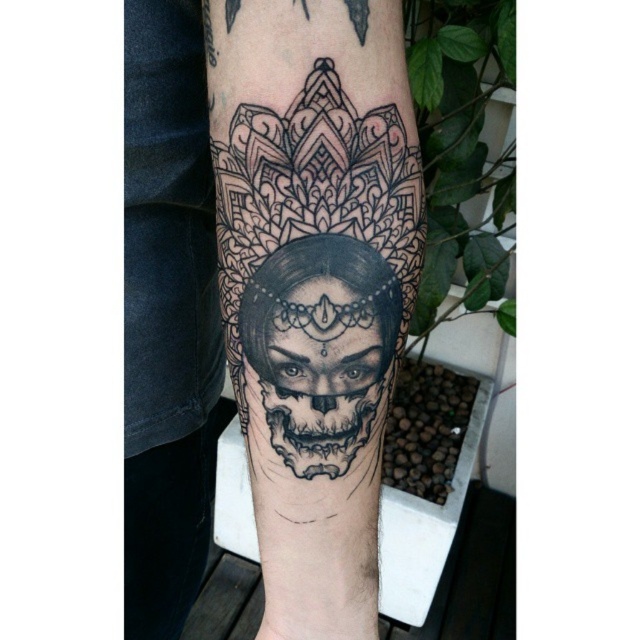
Question: Observing the image, what is the correct spatial positioning of black tattooed skull at center in reference to black detailed skull at center?

Choices:
 (A) left
 (B) right

Answer: (A)

Question: Which point appears farthest from the camera in this image?

Choices:
 (A) (340, 388)
 (B) (280, 100)

Answer: (A)

Question: Can you confirm if black tattooed skull at center is positioned to the right of black detailed skull at center?

Choices:
 (A) yes
 (B) no

Answer: (B)

Question: Can you confirm if black tattooed skull at center is positioned to the left of black detailed skull at center?

Choices:
 (A) no
 (B) yes

Answer: (B)